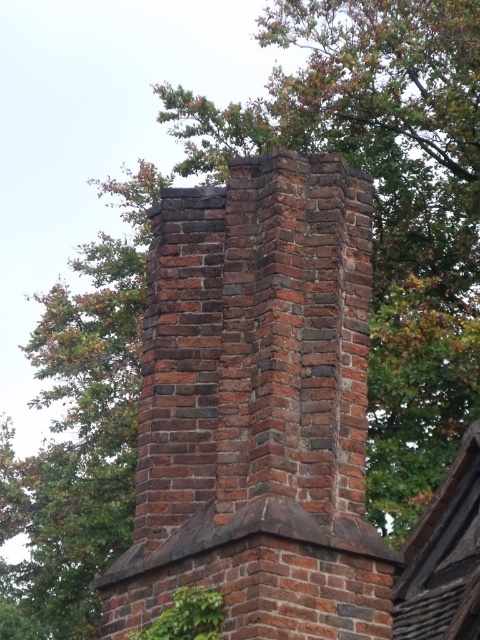
Is brown shingles at upper center positioned before green leafy ivy at lower center?

No, brown shingles at upper center is further to the viewer.

Is brown shingles at upper center to the left of green leafy ivy at lower center from the viewer's perspective?

In fact, brown shingles at upper center is to the right of green leafy ivy at lower center.

Is point (474, 557) farther from viewer compared to point (137, 637)?

Yes, it is.

Identify the location of brown shingles at upper center. (444, 556).

Can you confirm if red brick chimney at center is thinner than brown shingles at upper center?

No.

From the picture: Measure the distance between red brick chimney at center and brown shingles at upper center.

8.06 meters

Does point (312, 209) come closer to viewer compared to point (472, 588)?

Yes, point (312, 209) is in front of point (472, 588).

Where is `red brick chimney at center`? This screenshot has width=480, height=640. red brick chimney at center is located at coordinates (257, 406).

Which is more to the left, red brick chimney at center or green leafy ivy at lower center?

green leafy ivy at lower center

Find the location of `red brick chimney at center`. red brick chimney at center is located at coordinates (257, 406).

Identify the location of red brick chimney at center. (257, 406).